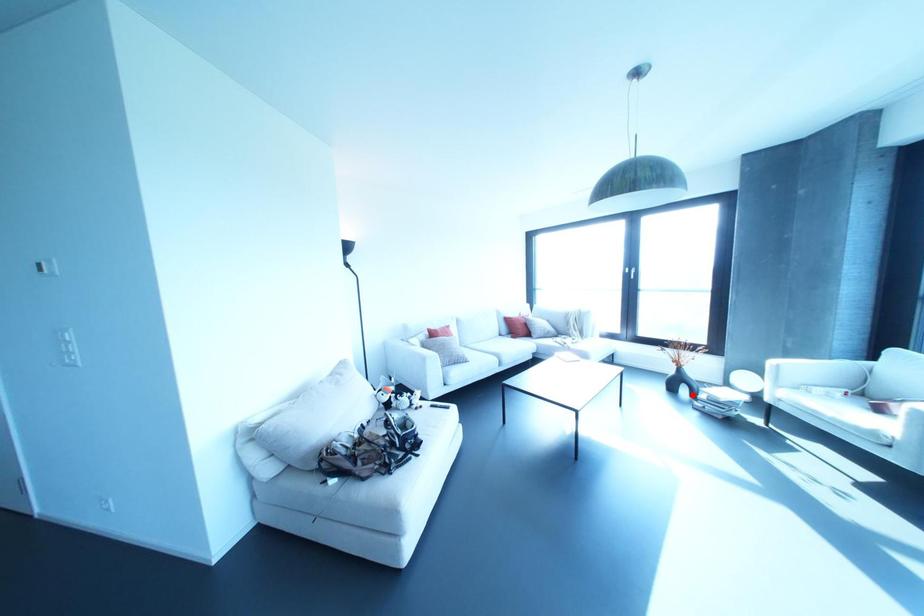
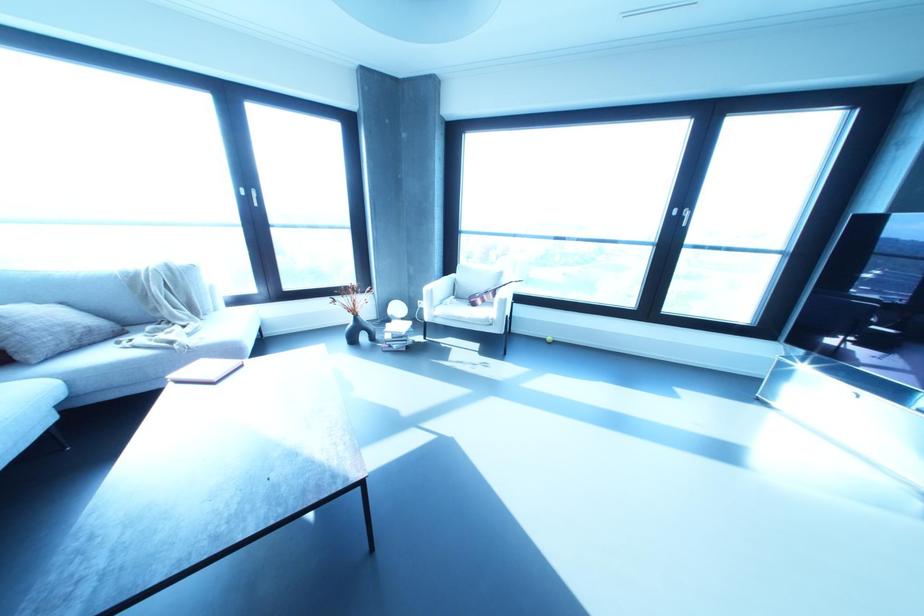
In the second image, find the point that corresponds to the highlighted location in the first image.

(371, 338)